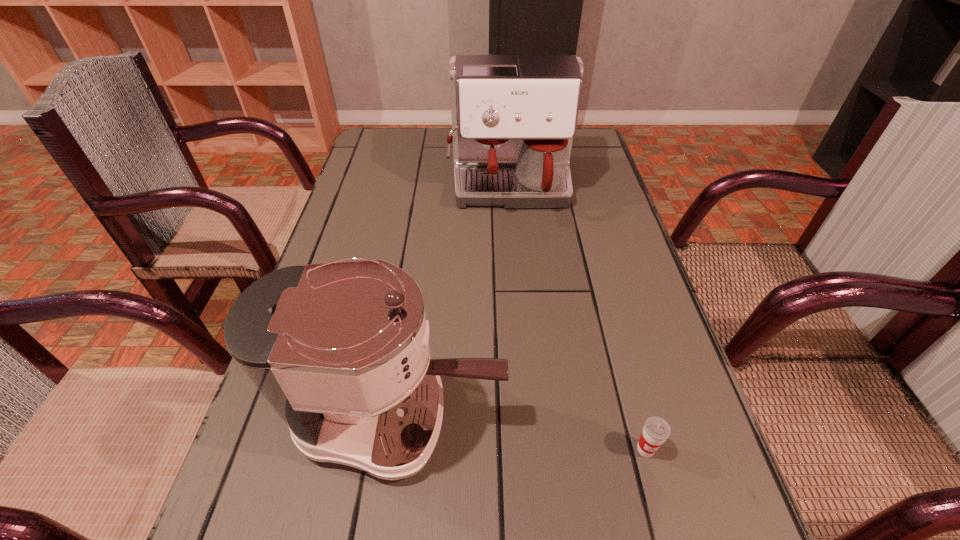
Where is `vacant area that lies between the nearer coffee maker and the shortest object`? The image size is (960, 540). vacant area that lies between the nearer coffee maker and the shortest object is located at coordinates (522, 434).

What are the coordinates of `free spot between the nearer coffee maker and the farthest object` in the screenshot? It's located at (454, 304).

Locate which object is the second closest to the cup. Please provide its 2D coordinates. Your answer should be formatted as a tuple, i.e. [(x, y)], where the tuple contains the x and y coordinates of a point satisfying the conditions above.

[(514, 117)]

Find the location of a particular element. The width and height of the screenshot is (960, 540). object that stands as the second closest to the nearer coffee maker is located at coordinates (514, 117).

What are the coordinates of `vacant space that satisfies the following two spatial constraints: 1. on the front of the farther coffee maker near the spout; 2. on the front-facing side of the nearer coffee maker` in the screenshot? It's located at (528, 418).

At what (x,y) coordinates should I click in order to perform the action: click on free location that satisfies the following two spatial constraints: 1. on the front of the farther coffee maker near the spout; 2. on the front-facing side of the nearer coffee maker. Please return your answer as a coordinate pair (x, y). This screenshot has height=540, width=960. Looking at the image, I should click on (528, 418).

Identify the location of free space that satisfies the following two spatial constraints: 1. on the front of the farther coffee maker near the spout; 2. on the front-facing side of the nearer coffee maker. (528, 418).